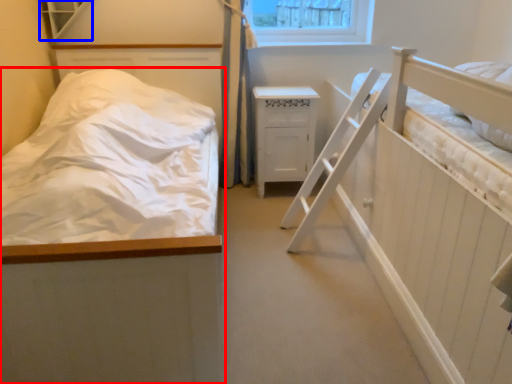
Question: Which object is closer to the camera taking this photo, bed (highlighted by a red box) or window (highlighted by a blue box)?

Choices:
 (A) bed
 (B) window

Answer: (A)